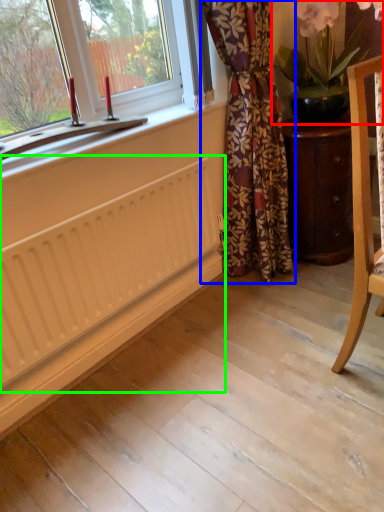
Question: Which object is the farthest from houseplant (highlighted by a red box)? Choose among these: curtain (highlighted by a blue box) or radiator (highlighted by a green box).

Choices:
 (A) curtain
 (B) radiator

Answer: (B)